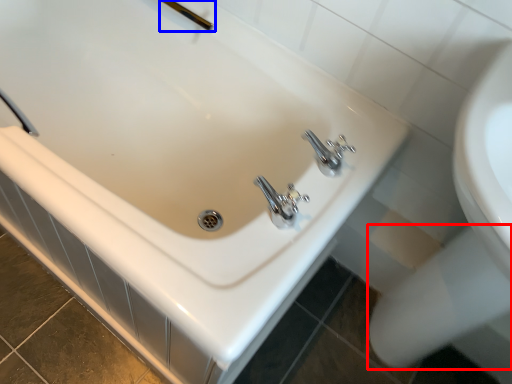
Question: Which object is closer to the camera taking this photo, bidet (highlighted by a red box) or shower (highlighted by a blue box)?

Choices:
 (A) bidet
 (B) shower

Answer: (A)